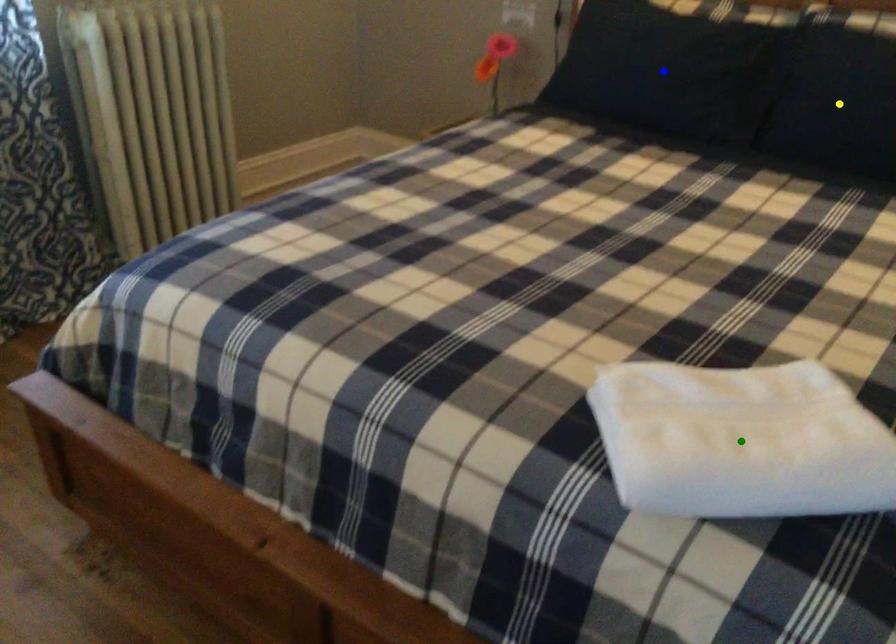
Order these from nearest to farthest:
blue point, green point, yellow point

green point
yellow point
blue point